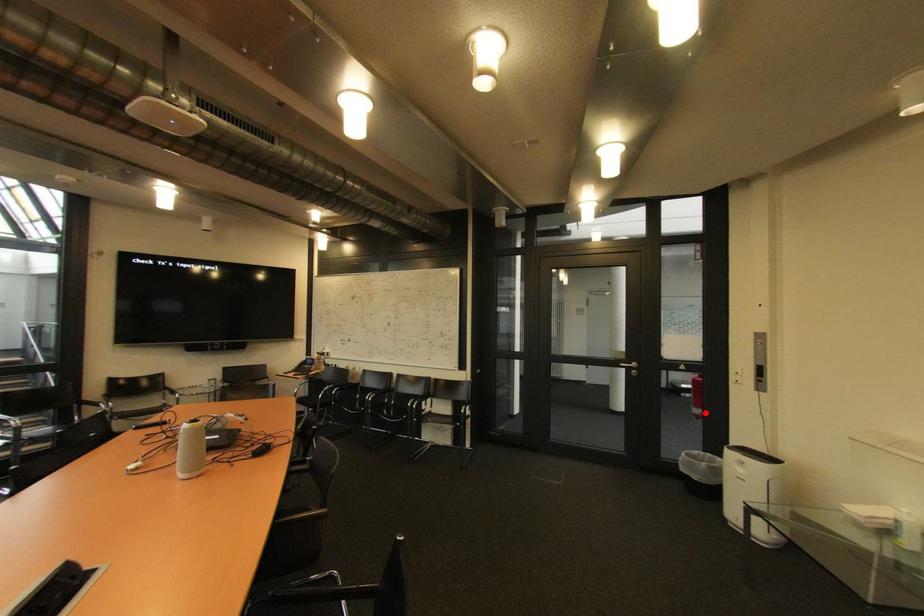
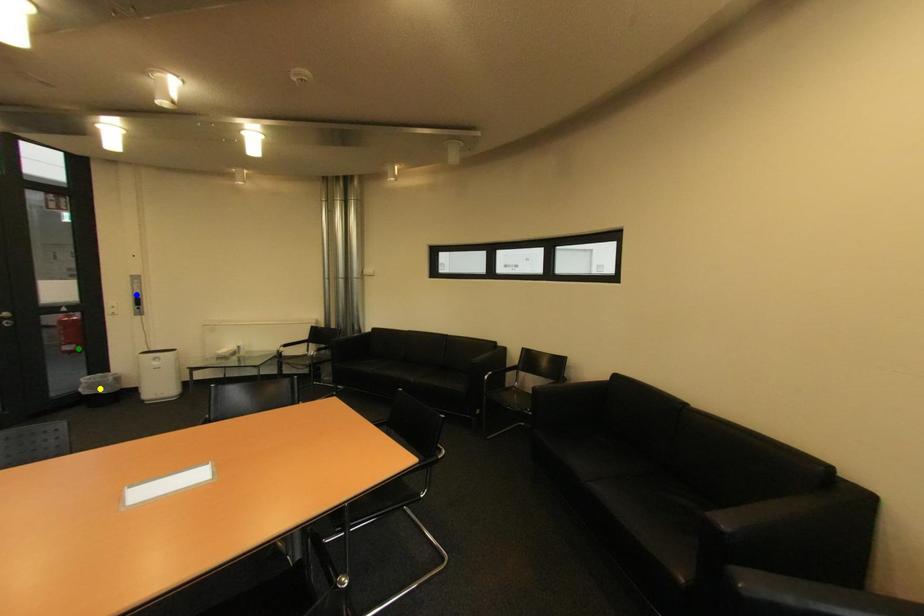
Question: I am providing you with two images of the same scene from different viewpoints. A red point is marked on the first image. You are given multiple points on the second image. In image 2, which mark is for the same physical point as the one in image 1?

Choices:
 (A) blue point
 (B) green point
 (C) yellow point

Answer: (B)